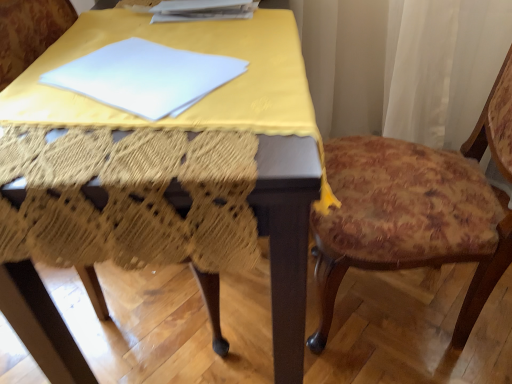
I want to click on vacant space positioned to the left of white paper at upper center, so click(x=119, y=26).